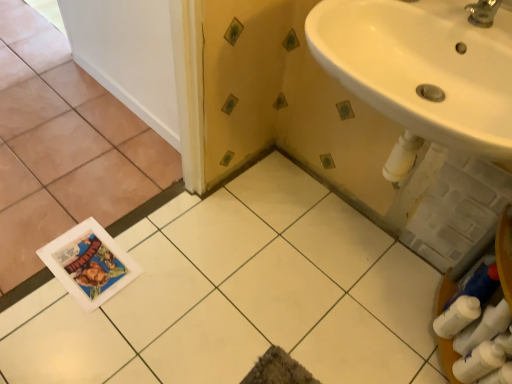
Locate an element on the screen. free space in front of white smooth door at upper left is located at coordinates (94, 157).